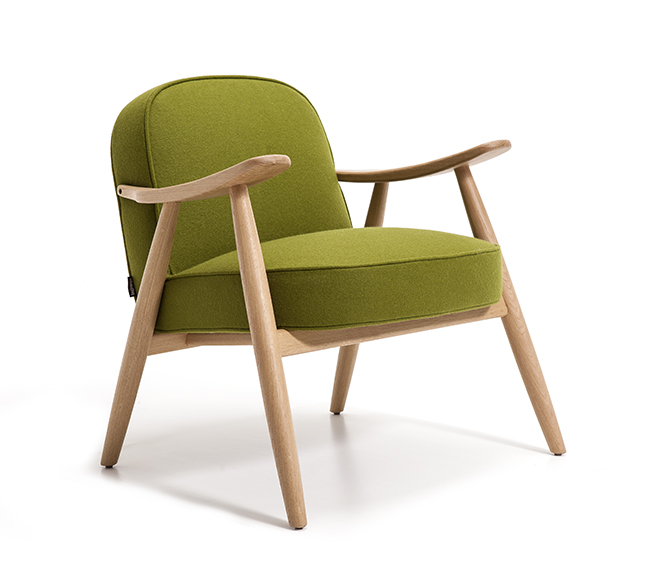
Locate an element on the screen. Image resolution: width=648 pixels, height=576 pixels. cushion is located at coordinates (306, 249), (260, 109).